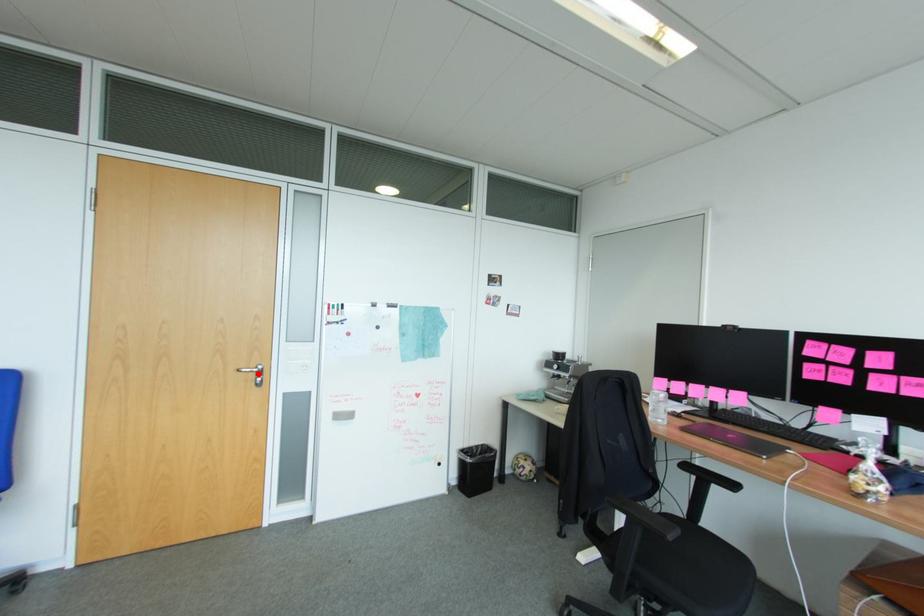
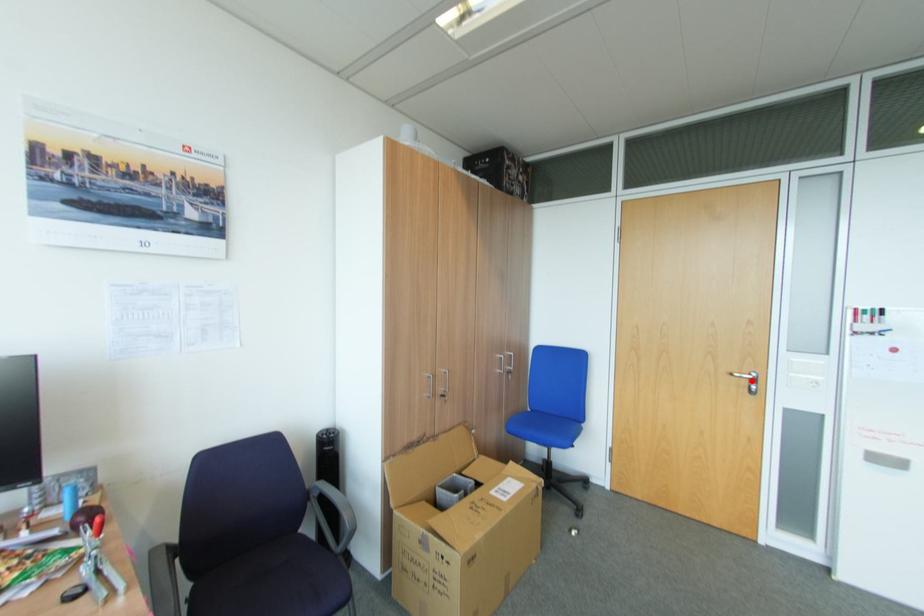
I am providing you with two images of the same scene from different viewpoints. A red point is marked on the first image and another point is marked on the second image. Does the point marked in image1 correspond to the same location as the one in image2?

Yes